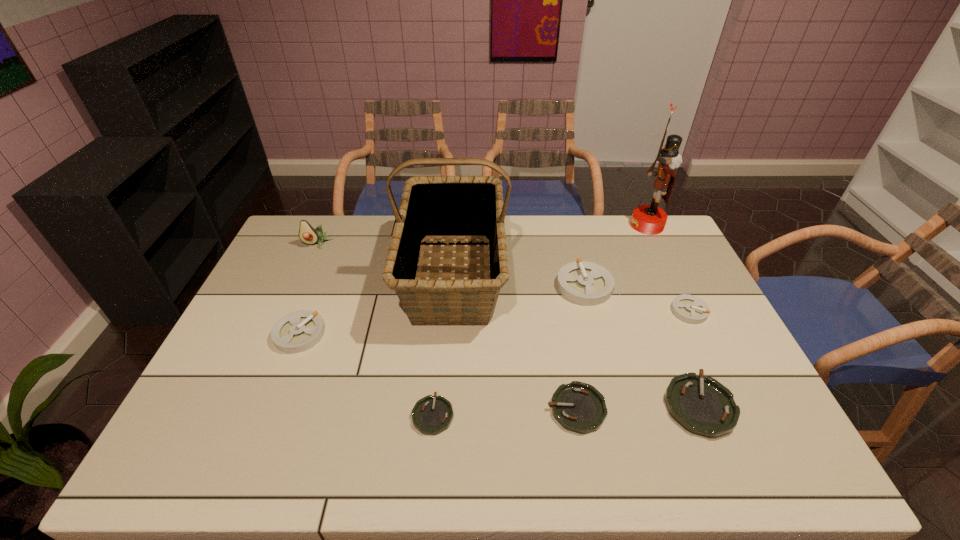
I want to click on ashtray object that ranks as the fourth closest to the avocado, so click(x=579, y=407).

Image resolution: width=960 pixels, height=540 pixels. I want to click on gray ashtray that stands as the closest to the tallest ashtray, so click(x=690, y=309).

The image size is (960, 540). Identify the location of gray ashtray that is the second nearest to the rightmost gray ashtray. [x=298, y=331].

Select which green ashtray appears as the closest to the leftmost gray ashtray. Please provide its 2D coordinates. Your answer should be formatted as a tuple, i.e. [(x, y)], where the tuple contains the x and y coordinates of a point satisfying the conditions above.

[(431, 415)]

Select which green ashtray is the closest to the tallest ashtray. Please provide its 2D coordinates. Your answer should be formatted as a tuple, i.e. [(x, y)], where the tuple contains the x and y coordinates of a point satisfying the conditions above.

[(703, 406)]

Where is `free region that satisfies the following two spatial constraints: 1. on the seed side of the avocado; 2. on the left side of the shortest ashtray`? The width and height of the screenshot is (960, 540). free region that satisfies the following two spatial constraints: 1. on the seed side of the avocado; 2. on the left side of the shortest ashtray is located at coordinates (241, 415).

Locate an element on the screen. The width and height of the screenshot is (960, 540). free point that satisfies the following two spatial constraints: 1. on the back side of the smallest gray ashtray; 2. on the right side of the second green ashtray from right to left is located at coordinates (559, 311).

At what (x,y) coordinates should I click in order to perform the action: click on vacant region that satisfies the following two spatial constraints: 1. on the back side of the smallest green ashtray; 2. on the right side of the second biggest green ashtray. Please return your answer as a coordinate pair (x, y). The image size is (960, 540). Looking at the image, I should click on (434, 409).

This screenshot has height=540, width=960. Find the location of `free space that satisfies the following two spatial constraints: 1. by the handle of the rightmost green ashtray; 2. on the right side of the basket`. free space that satisfies the following two spatial constraints: 1. by the handle of the rightmost green ashtray; 2. on the right side of the basket is located at coordinates (444, 406).

What are the coordinates of `vacant area that satisfies the following two spatial constraints: 1. on the front-facing side of the nutcracker; 2. on the front side of the second green ashtray from left to right` in the screenshot? It's located at (735, 409).